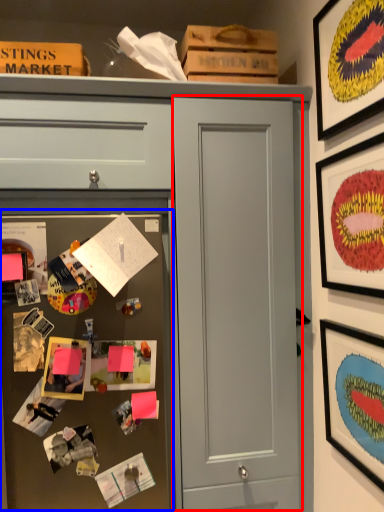
Question: Which object is closer to the camera taking this photo, door (highlighted by a red box) or fridge (highlighted by a blue box)?

Choices:
 (A) door
 (B) fridge

Answer: (B)